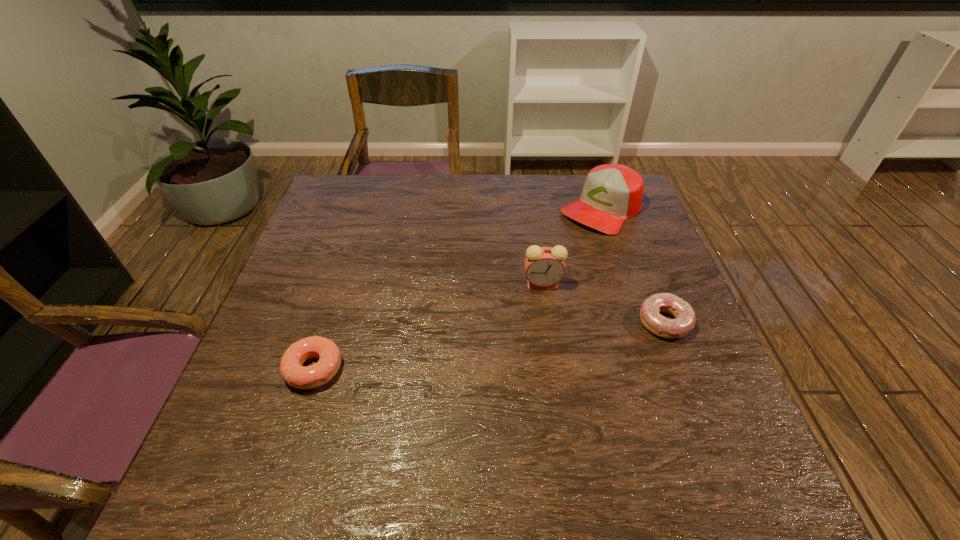
Identify the location of the left doughnut. The width and height of the screenshot is (960, 540). (301, 377).

Find the location of a particular element. The height and width of the screenshot is (540, 960). the nearest object is located at coordinates (301, 377).

Find the location of a particular element. The image size is (960, 540). the right doughnut is located at coordinates (685, 319).

Where is `the third farthest object`? The image size is (960, 540). the third farthest object is located at coordinates (685, 319).

Where is `the second object from left to right`? This screenshot has width=960, height=540. the second object from left to right is located at coordinates (544, 266).

Locate an element on the screen. This screenshot has height=540, width=960. the third nearest object is located at coordinates (544, 266).

This screenshot has height=540, width=960. Identify the location of baseball cap. (612, 193).

At what (x,y) coordinates should I click in order to perform the action: click on free space located on the back of the left doughnut. Please return your answer as a coordinate pair (x, y). The height and width of the screenshot is (540, 960). Looking at the image, I should click on (333, 308).

The height and width of the screenshot is (540, 960). Find the location of `free space located on the back of the farther doughnut`. free space located on the back of the farther doughnut is located at coordinates (641, 264).

The width and height of the screenshot is (960, 540). I want to click on vacant area situated 0.240m on the face of the third nearest object, so click(x=465, y=349).